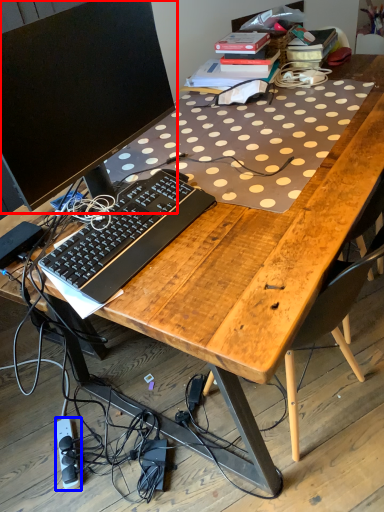
Question: Which object appears closest to the camera in this image, computer monitor (highlighted by a red box) or equipment (highlighted by a blue box)?

Choices:
 (A) computer monitor
 (B) equipment

Answer: (A)